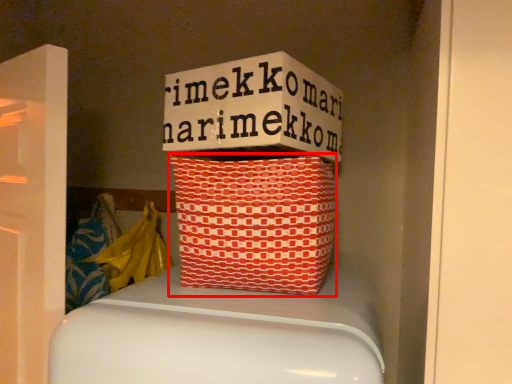
Question: From the image's perspective, what is the correct spatial positioning of basket (annotated by the red box) in reference to material?

Choices:
 (A) below
 (B) above

Answer: (B)